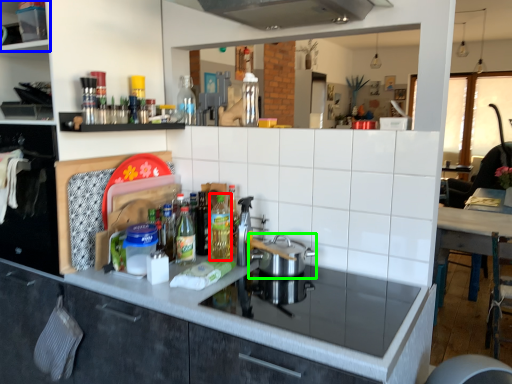
Question: Based on their relative distances, which object is nearer to bottle (highlighted by a red box)? Choose from shelf (highlighted by a blue box) and kitchen appliance (highlighted by a green box).

Choices:
 (A) shelf
 (B) kitchen appliance

Answer: (B)